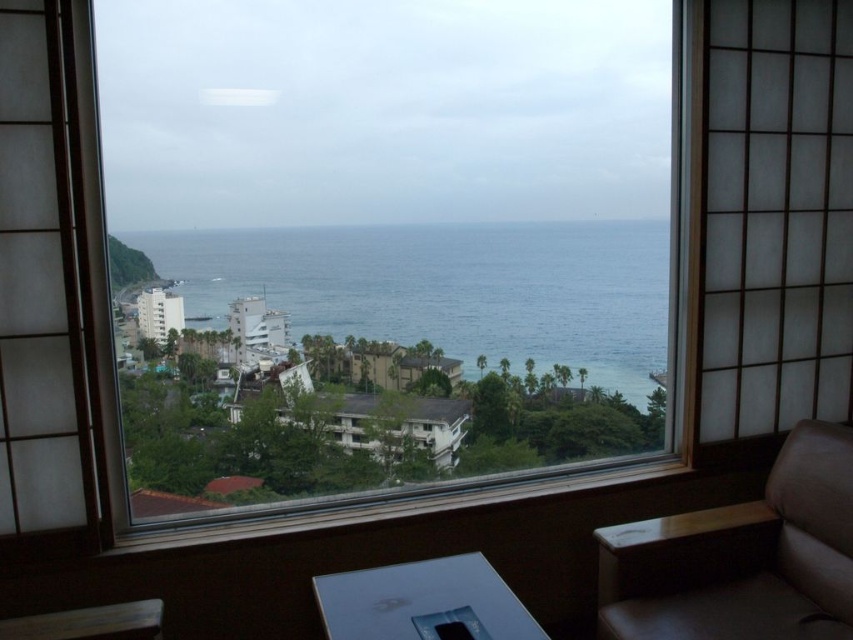
Is blue water at center smaller than brown leather couch at lower right?

Incorrect, blue water at center is not smaller in size than brown leather couch at lower right.

Does blue water at center appear over brown leather couch at lower right?

Indeed, blue water at center is positioned over brown leather couch at lower right.

Is point (396, 326) closer to viewer compared to point (782, 609)?

No, it is not.

I want to click on blue water at center, so click(x=445, y=289).

Which is behind, point (120, 237) or point (273, 280)?

The point (273, 280) is behind.

Who is higher up, wooden frame at center or blue water at center?

wooden frame at center is above.

Where is `wooden frame at center`? This screenshot has width=853, height=640. wooden frame at center is located at coordinates (387, 241).

Locate an element on the screen. wooden frame at center is located at coordinates (x=387, y=241).

Does wooden frame at center have a lesser height compared to brown leather couch at lower right?

No, wooden frame at center is not shorter than brown leather couch at lower right.

Which is below, wooden frame at center or brown leather couch at lower right?

brown leather couch at lower right is lower down.

Is point (453, 182) closer to viewer compared to point (809, 496)?

No, it is behind (809, 496).

The image size is (853, 640). I want to click on wooden frame at center, so click(x=387, y=241).